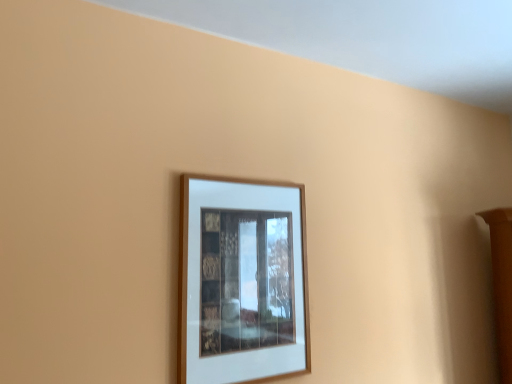
Where is `wooden frame at upper center`? wooden frame at upper center is located at coordinates (242, 281).

The height and width of the screenshot is (384, 512). What do you see at coordinates (242, 281) in the screenshot? I see `wooden frame at upper center` at bounding box center [242, 281].

Image resolution: width=512 pixels, height=384 pixels. In order to click on wooden frame at upper center in this screenshot , I will do `click(242, 281)`.